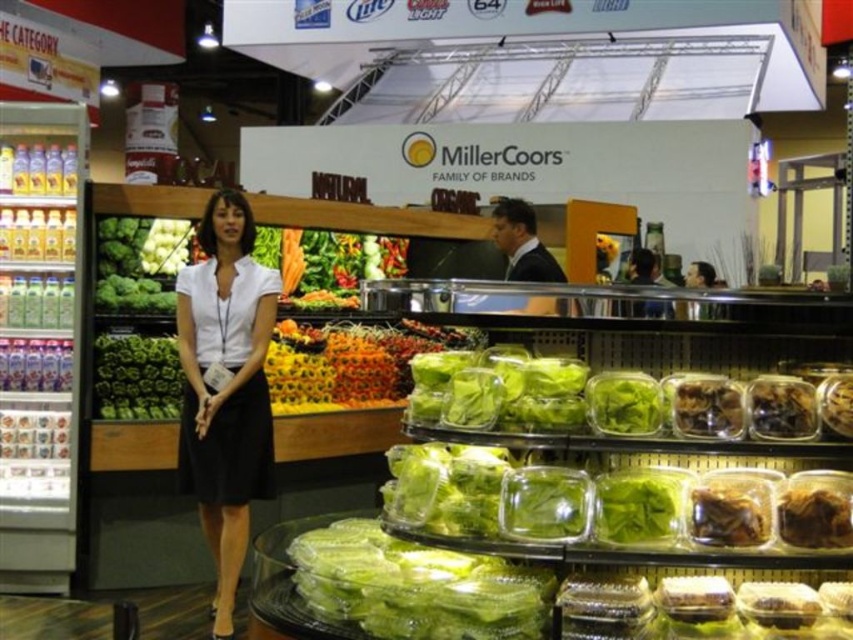
From the picture: Is white matte shirt at center above brown matte nuts at center?

Incorrect, white matte shirt at center is not positioned above brown matte nuts at center.

Which is above, white matte shirt at center or brown matte nuts at center?

brown matte nuts at center

Between point (229, 561) and point (689, 417), which one is positioned in front?

Point (689, 417) is in front.

Where is `white matte shirt at center`? The image size is (853, 640). white matte shirt at center is located at coordinates (225, 387).

Where is `green leafy lettuce at center`? green leafy lettuce at center is located at coordinates (135, 378).

Does green leafy lettuce at center have a lesser width compared to brown matte dried mushrooms at center?

Incorrect, green leafy lettuce at center's width is not less than brown matte dried mushrooms at center's.

Where is `green leafy lettuce at center`? The height and width of the screenshot is (640, 853). green leafy lettuce at center is located at coordinates (135, 378).

This screenshot has height=640, width=853. I want to click on green leafy lettuce at center, so click(135, 378).

Is white matte shirt at center thinner than green matte lettuce at center?

Incorrect, white matte shirt at center's width is not less than green matte lettuce at center's.

In the scene shown: Between white matte shirt at center and green matte lettuce at center, which one is positioned lower?

green matte lettuce at center

Who is more forward, (236, 436) or (608, 516)?

Positioned in front is point (608, 516).

At what (x,y) coordinates should I click in order to perform the action: click on white matte shirt at center. Please return your answer as a coordinate pair (x, y). Looking at the image, I should click on (225, 387).